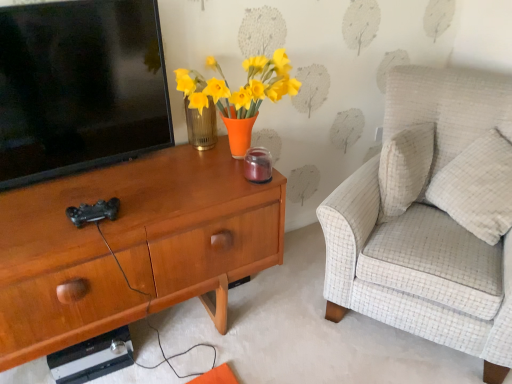
Locate an element on the screen. free region under black glossy television at left (from a real-world perspective) is located at coordinates (95, 167).